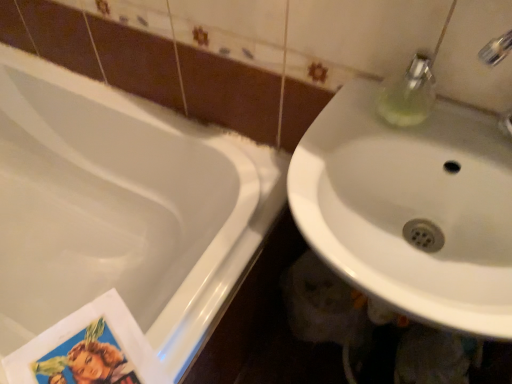
Question: Can you confirm if white glossy sink at right is shorter than white glossy bathtub at lower left?

Choices:
 (A) yes
 (B) no

Answer: (A)

Question: Is the position of white glossy sink at right more distant than that of white glossy bathtub at lower left?

Choices:
 (A) yes
 (B) no

Answer: (B)

Question: Can you confirm if white glossy sink at right is thinner than white glossy bathtub at lower left?

Choices:
 (A) yes
 (B) no

Answer: (A)

Question: Considering the relative sizes of white glossy sink at right and white glossy bathtub at lower left in the image provided, is white glossy sink at right wider than white glossy bathtub at lower left?

Choices:
 (A) no
 (B) yes

Answer: (A)

Question: Does white glossy sink at right have a greater height compared to white glossy bathtub at lower left?

Choices:
 (A) no
 (B) yes

Answer: (A)

Question: Is white glossy bathtub at lower left at the back of white glossy sink at right?

Choices:
 (A) yes
 (B) no

Answer: (B)

Question: Can you confirm if white glossy bathtub at lower left is thinner than white glossy sink at right?

Choices:
 (A) no
 (B) yes

Answer: (A)

Question: Does white glossy bathtub at lower left appear on the left side of white glossy sink at right?

Choices:
 (A) no
 (B) yes

Answer: (B)

Question: From a real-world perspective, does white glossy bathtub at lower left stand above white glossy sink at right?

Choices:
 (A) no
 (B) yes

Answer: (A)

Question: Is white glossy bathtub at lower left oriented away from white glossy sink at right?

Choices:
 (A) yes
 (B) no

Answer: (B)

Question: From the image's perspective, is white glossy bathtub at lower left above white glossy sink at right?

Choices:
 (A) yes
 (B) no

Answer: (B)

Question: Is white glossy bathtub at lower left surrounding white glossy sink at right?

Choices:
 (A) no
 (B) yes

Answer: (A)

Question: From the image's perspective, relative to white glossy bathtub at lower left, is white glossy sink at right above or below?

Choices:
 (A) below
 (B) above

Answer: (B)